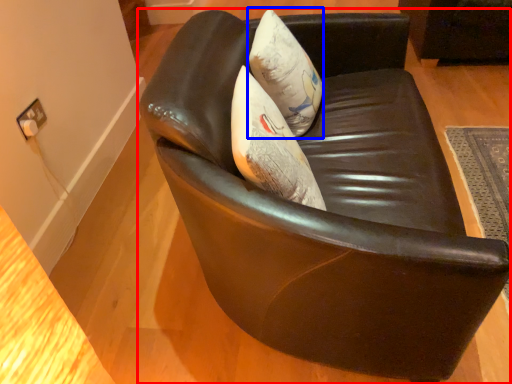
Question: Which object is further to the camera taking this photo, chair (highlighted by a red box) or throw pillow (highlighted by a blue box)?

Choices:
 (A) chair
 (B) throw pillow

Answer: (B)